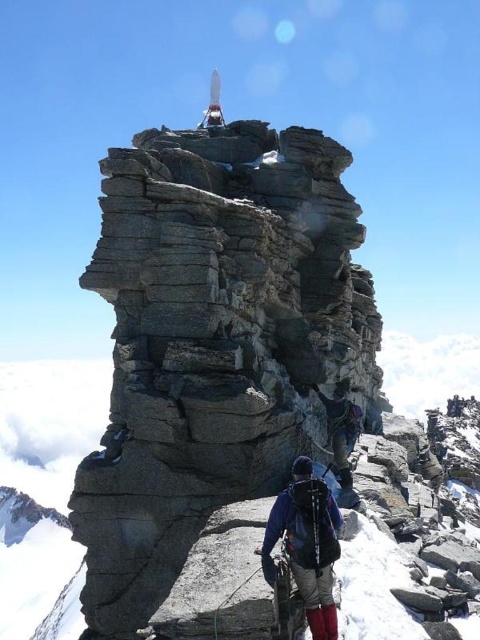
You are a hiker trying to decide whether to take a selfie with both the matte blue jacket at center and the dark blue fabric backpack at center in the frame. Based on their heights, which one should you position closer to the camera to ensure both are fully visible?

The matte blue jacket at center is shorter than the dark blue fabric backpack at center. To ensure both are fully visible in the selfie, position the shorter matte blue jacket at center closer to the camera so it appears larger in the frame, while the taller dark blue fabric backpack at center can be slightly farther back.

You are a hiker who wants to take a photo of the gray rough rock at center and the dark blue fabric backpack at center. Which object should you focus on first if you want to capture both in the same frame without moving your camera?

You should focus on the gray rough rock at center first because it is much taller than the dark blue fabric backpack at center, so adjusting focus to the taller object ensures both are in frame.

You are a hiker trying to decide whether to climb the gray rough rock at center. You notice the matte blue jacket at center. Is the person wearing the jacket closer to you or farther away than the rock?

The matte blue jacket at center is behind gray rough rock at center, so the person wearing the matte blue jacket at center is farther away from you than the rock.